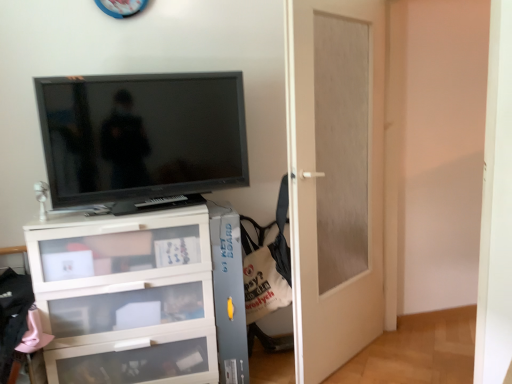
Question: Is matte black television at upper left thinner than white matte door at center?

Choices:
 (A) no
 (B) yes

Answer: (B)

Question: Is matte black television at upper left not inside white matte door at center?

Choices:
 (A) yes
 (B) no

Answer: (A)

Question: Is matte black television at upper left to the left of white matte door at center from the viewer's perspective?

Choices:
 (A) no
 (B) yes

Answer: (B)

Question: Would you say white matte door at center is part of matte black television at upper left's contents?

Choices:
 (A) yes
 (B) no

Answer: (B)

Question: Does matte black television at upper left have a larger size compared to white matte door at center?

Choices:
 (A) no
 (B) yes

Answer: (A)

Question: Is matte black television at upper left oriented away from white matte door at center?

Choices:
 (A) yes
 (B) no

Answer: (B)

Question: Is white matte door at center outside of matte black television at upper left?

Choices:
 (A) no
 (B) yes

Answer: (B)

Question: From the image's perspective, would you say white matte door at center is shown under matte black television at upper left?

Choices:
 (A) no
 (B) yes

Answer: (B)

Question: Is white matte door at center oriented towards matte black television at upper left?

Choices:
 (A) no
 (B) yes

Answer: (A)

Question: Considering the relative sizes of white matte door at center and matte black television at upper left in the image provided, is white matte door at center bigger than matte black television at upper left?

Choices:
 (A) yes
 (B) no

Answer: (A)

Question: Considering the relative sizes of white matte door at center and matte black television at upper left in the image provided, is white matte door at center wider than matte black television at upper left?

Choices:
 (A) no
 (B) yes

Answer: (B)

Question: Is white matte door at center thinner than matte black television at upper left?

Choices:
 (A) no
 (B) yes

Answer: (A)

Question: From a real-world perspective, is matte black television at upper left physically located above or below white matte door at center?

Choices:
 (A) below
 (B) above

Answer: (B)